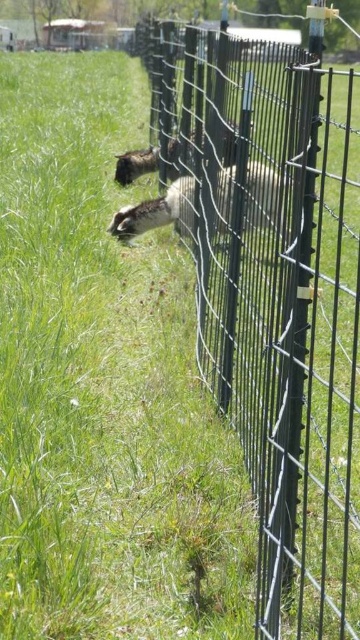
Question: Considering the relative positions of black wire fence at center and white woolen sheep at center in the image provided, where is black wire fence at center located with respect to white woolen sheep at center?

Choices:
 (A) left
 (B) right

Answer: (B)

Question: Is black wire fence at center thinner than white woolen sheep at center?

Choices:
 (A) no
 (B) yes

Answer: (A)

Question: Is black wire fence at center positioned at the back of white woolen sheep at center?

Choices:
 (A) no
 (B) yes

Answer: (A)

Question: Which object is farther from the camera taking this photo?

Choices:
 (A) black wire fence at center
 (B) white woolen sheep at center

Answer: (B)